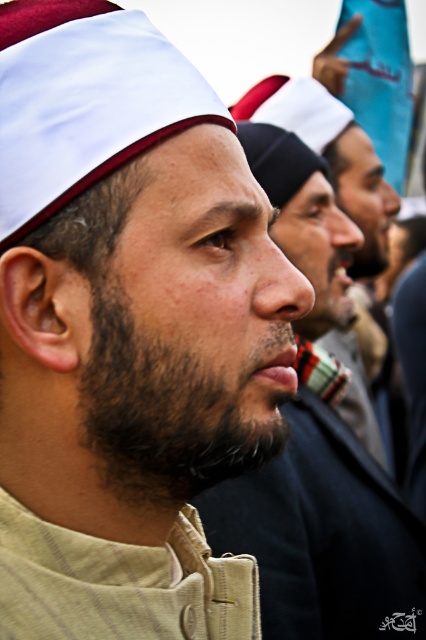
Between beige fabric cap at center and white fabric cap at center, which one appears on the left side from the viewer's perspective?

white fabric cap at center is more to the left.

Is point (95, 163) behind point (180, 113)?

No.

Between point (189, 605) and point (146, 122), which one is positioned behind?

Point (189, 605)

Locate an element on the screen. This screenshot has width=426, height=640. beige fabric cap at center is located at coordinates (127, 330).

Is beige fabric cap at center positioned before dark brown fuzzy beard at center?

Yes, beige fabric cap at center is closer to the viewer.

Is beige fabric cap at center behind dark brown fuzzy beard at center?

No, beige fabric cap at center is closer to the viewer.

The width and height of the screenshot is (426, 640). What are the coordinates of `beige fabric cap at center` in the screenshot? It's located at (127, 330).

At what (x,y) coordinates should I click in order to perform the action: click on beige fabric cap at center. Please return your answer as a coordinate pair (x, y). The width and height of the screenshot is (426, 640). Looking at the image, I should click on (127, 330).

Describe the element at coordinates (83, 100) in the screenshot. I see `white fabric cap at center` at that location.

In the scene shown: Who is more distant from viewer, (111, 67) or (126, 476)?

The point (126, 476) is more distant.

Locate an element on the screen. The width and height of the screenshot is (426, 640). white fabric cap at center is located at coordinates (83, 100).